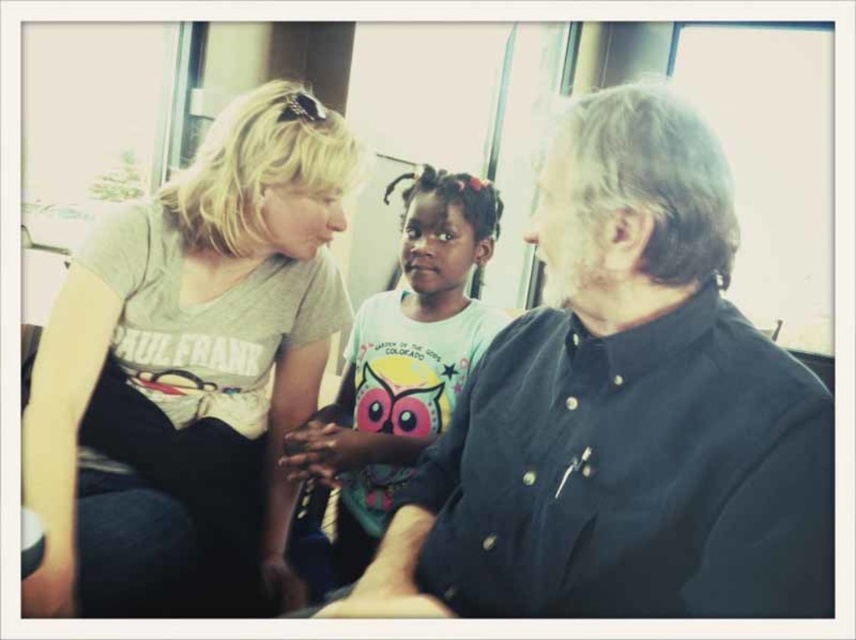
Question: Does dark blue button-up shirt at center appear on the right side of gray cotton t-shirt at upper left?

Choices:
 (A) no
 (B) yes

Answer: (B)

Question: Does dark blue button-up shirt at center have a smaller size compared to white cotton shirt at center?

Choices:
 (A) no
 (B) yes

Answer: (B)

Question: Estimate the real-world distances between objects in this image. Which object is closer to the gray cotton t-shirt at upper left?

Choices:
 (A) dark blue button-up shirt at center
 (B) white cotton shirt at center

Answer: (B)

Question: Is dark blue button-up shirt at center below gray cotton t-shirt at upper left?

Choices:
 (A) yes
 (B) no

Answer: (A)

Question: Which object appears closest to the camera in this image?

Choices:
 (A) dark blue button-up shirt at center
 (B) gray cotton t-shirt at upper left
 (C) white cotton shirt at center

Answer: (A)

Question: Which point appears closest to the camera in this image?

Choices:
 (A) (294, 472)
 (B) (627, 385)

Answer: (B)